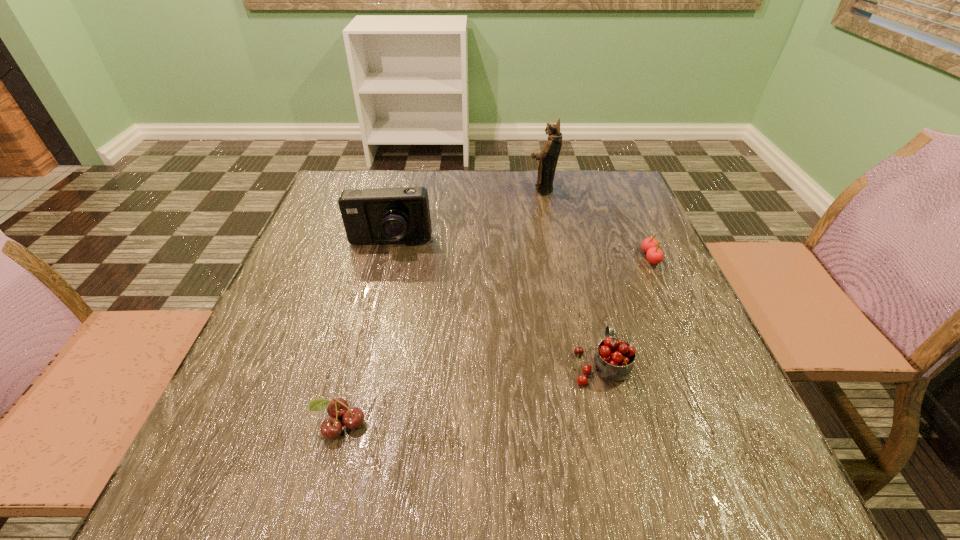
This screenshot has height=540, width=960. In order to click on the closest cherry to the rightmost object in this screenshot , I will do `click(613, 360)`.

What are the coordinates of `vacant space that satisfies the following two spatial constraints: 1. on the handle side of the third shortest object; 2. on the front-facing side of the farthest object` in the screenshot? It's located at (557, 189).

Locate an element on the screen. free space that satisfies the following two spatial constraints: 1. on the front-facing side of the second tallest object; 2. on the right side of the rightmost object is located at coordinates (386, 257).

Locate an element on the screen. Image resolution: width=960 pixels, height=540 pixels. free region that satisfies the following two spatial constraints: 1. on the front-facing side of the figurine; 2. on the handle side of the second nearest object is located at coordinates (577, 364).

Where is `vacant region that satisfies the following two spatial constraints: 1. on the front-facing side of the tallest object; 2. on the back side of the farthest cherry`? vacant region that satisfies the following two spatial constraints: 1. on the front-facing side of the tallest object; 2. on the back side of the farthest cherry is located at coordinates (556, 257).

I want to click on free spot that satisfies the following two spatial constraints: 1. on the front-facing side of the tallest object; 2. on the leaves of the nearest object, so click(x=588, y=424).

Identify the location of vacant position in the image that satisfies the following two spatial constraints: 1. on the front-facing side of the figurine; 2. on the handle side of the second cherry from right to left. (577, 364).

Where is `free space that satisfies the following two spatial constraints: 1. on the front-facing side of the farthest object; 2. on the handle side of the fourth farthest object`? free space that satisfies the following two spatial constraints: 1. on the front-facing side of the farthest object; 2. on the handle side of the fourth farthest object is located at coordinates (577, 364).

Locate an element on the screen. blank area in the image that satisfies the following two spatial constraints: 1. on the handle side of the tallest cherry; 2. on the left side of the rightmost cherry is located at coordinates (574, 257).

This screenshot has height=540, width=960. Identify the location of vacant region that satisfies the following two spatial constraints: 1. on the front-facing side of the figurine; 2. on the handle side of the second cherry from right to left. (577, 364).